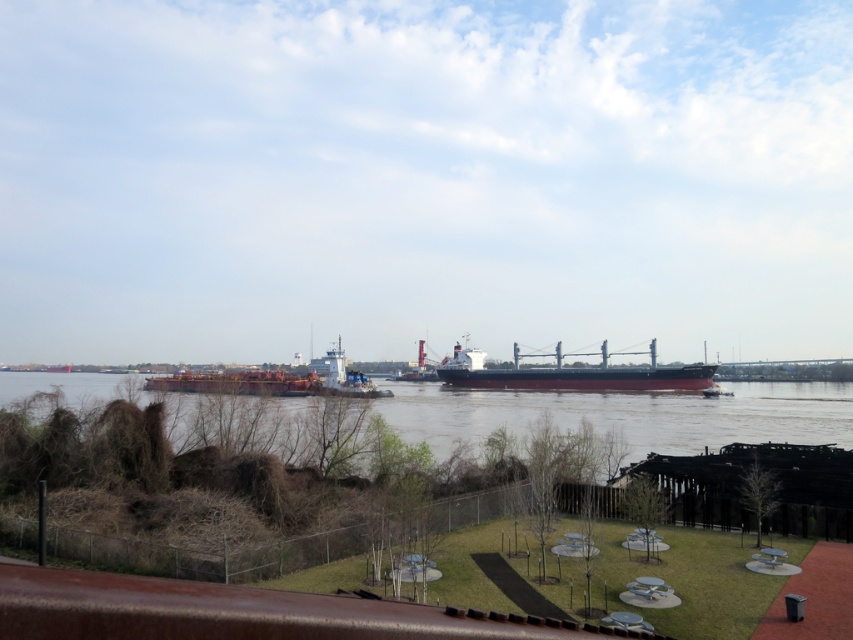
Between brown matte river at center and dark blue matte cargo ship at center, which one has less height?

With less height is dark blue matte cargo ship at center.

The height and width of the screenshot is (640, 853). What do you see at coordinates (630, 413) in the screenshot?
I see `brown matte river at center` at bounding box center [630, 413].

The image size is (853, 640). I want to click on brown matte river at center, so click(630, 413).

Does dark blue matte cargo ship at center appear on the left side of rustic metal barge at center?

Incorrect, dark blue matte cargo ship at center is not on the left side of rustic metal barge at center.

Can you confirm if dark blue matte cargo ship at center is positioned above rustic metal barge at center?

No.

Find the location of a particular element. The width and height of the screenshot is (853, 640). dark blue matte cargo ship at center is located at coordinates (569, 376).

Does point (521, 410) lie in front of point (184, 371)?

Yes, it is.

Does brown matte river at center appear on the left side of rustic metal barge at center?

No, brown matte river at center is not to the left of rustic metal barge at center.

Is point (846, 438) behind point (247, 380)?

No, it is in front of (247, 380).

In order to click on brown matte river at center in this screenshot , I will do `click(630, 413)`.